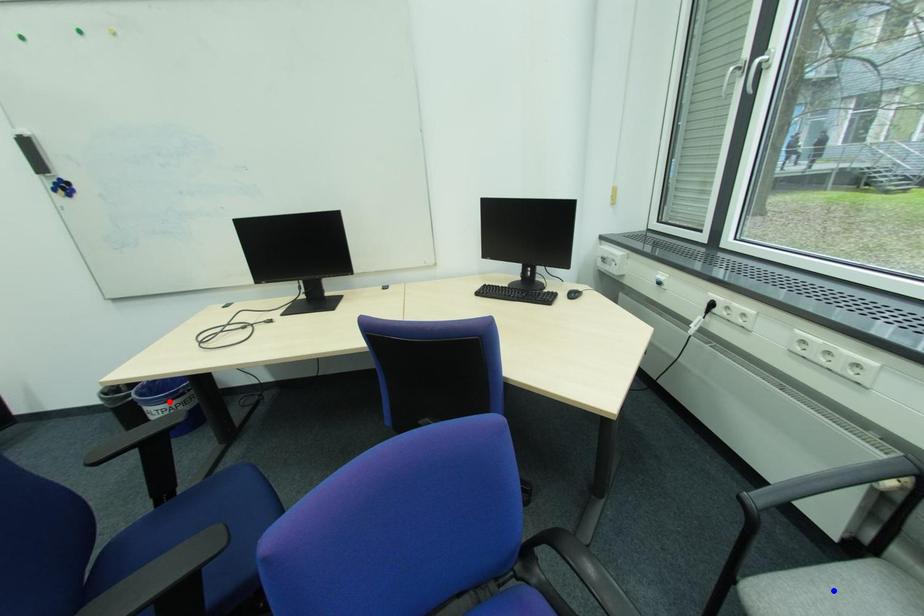
Question: Two points are marked on the image. Which point is closer to the camera?

Choices:
 (A) Blue point is closer.
 (B) Red point is closer.

Answer: (A)